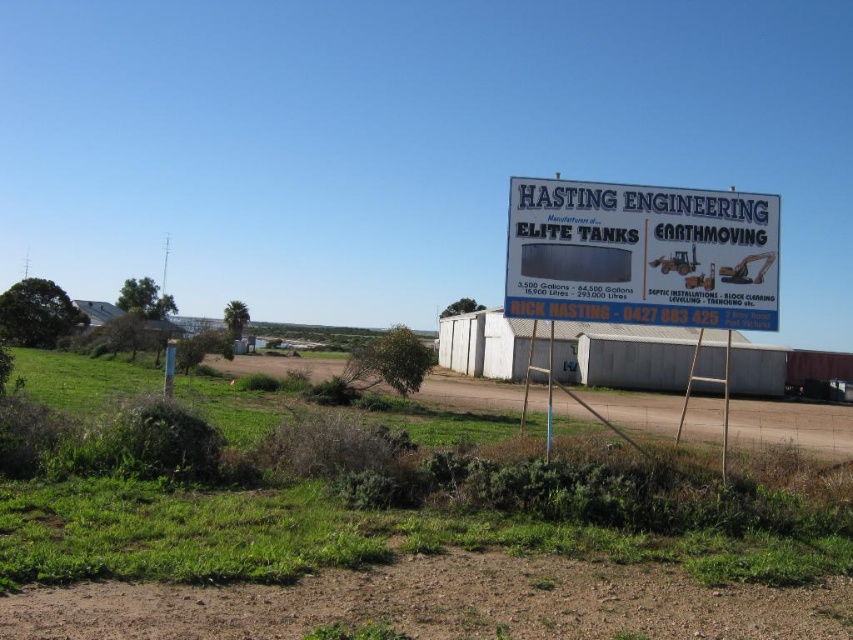
Question: Is white plastic sign at upper right to the left of brown dirt field at lower center from the viewer's perspective?

Choices:
 (A) no
 (B) yes

Answer: (A)

Question: Which object is the closest to the brown dirt track at lower center?

Choices:
 (A) brown dirt field at lower center
 (B) white plastic sign at upper right

Answer: (B)

Question: Which object is farther from the camera taking this photo?

Choices:
 (A) brown dirt track at lower center
 (B) brown dirt field at lower center
 (C) white plastic sign at upper right

Answer: (B)

Question: Does brown dirt track at lower center appear on the right side of white plastic sign at upper right?

Choices:
 (A) no
 (B) yes

Answer: (A)

Question: Which point is farther to the camera?

Choices:
 (A) (328, 362)
 (B) (601, 618)

Answer: (A)

Question: Can you confirm if brown dirt track at lower center is positioned below white plastic sign at upper right?

Choices:
 (A) no
 (B) yes

Answer: (B)